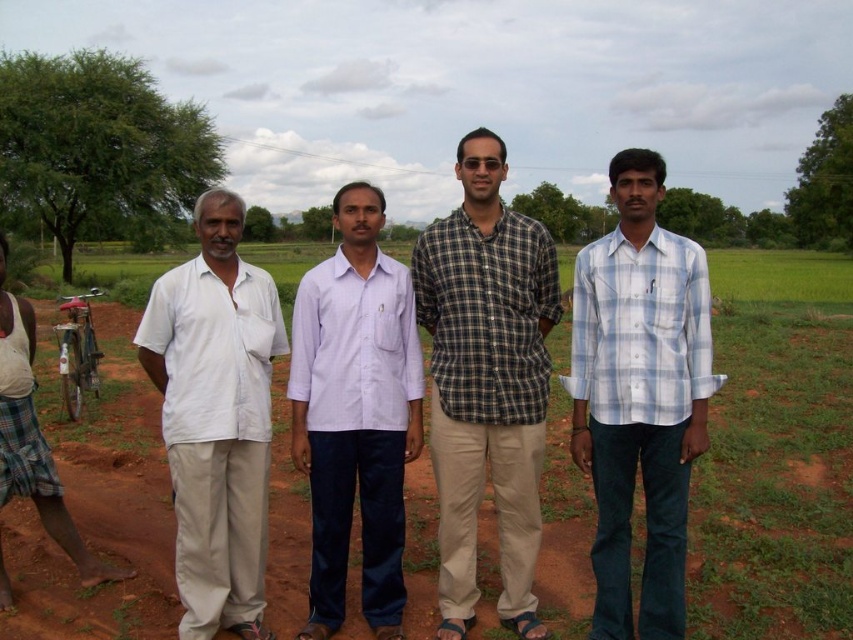
You are a photographer trying to capture a group photo of the light blue plaid shirt at center and the white cotton shirt at left. Since you want to ensure both subjects are visible, which subject should you place closer to the camera to avoid being blocked by the other?

The light blue plaid shirt at center is positioned on the right side of white cotton shirt at left. To ensure both are visible, you should place the white cotton shirt at left closer to the camera so it doesn

Based on the scene description, where is the checkered fabric shirt at center located in the image?

The checkered fabric shirt at center is located at point (486, 381).